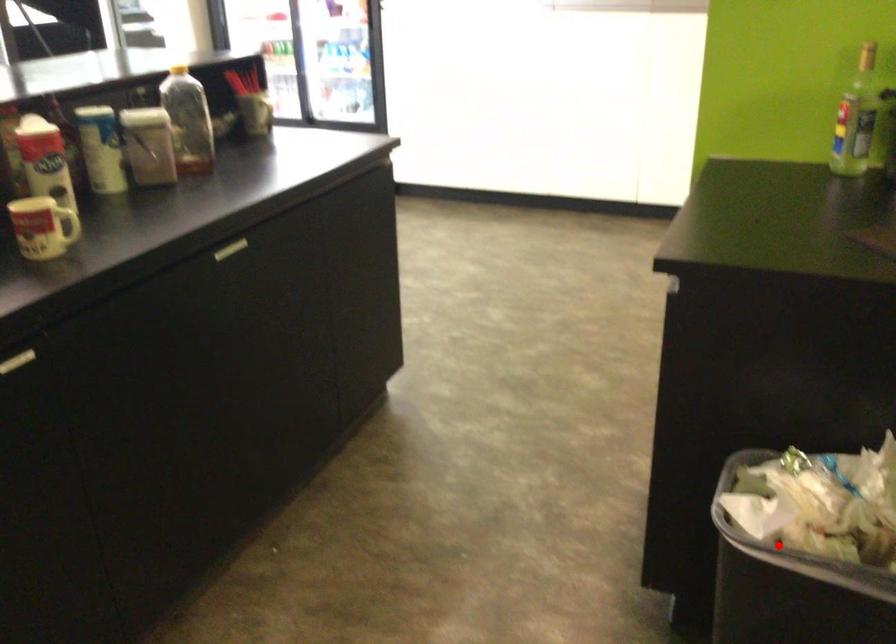
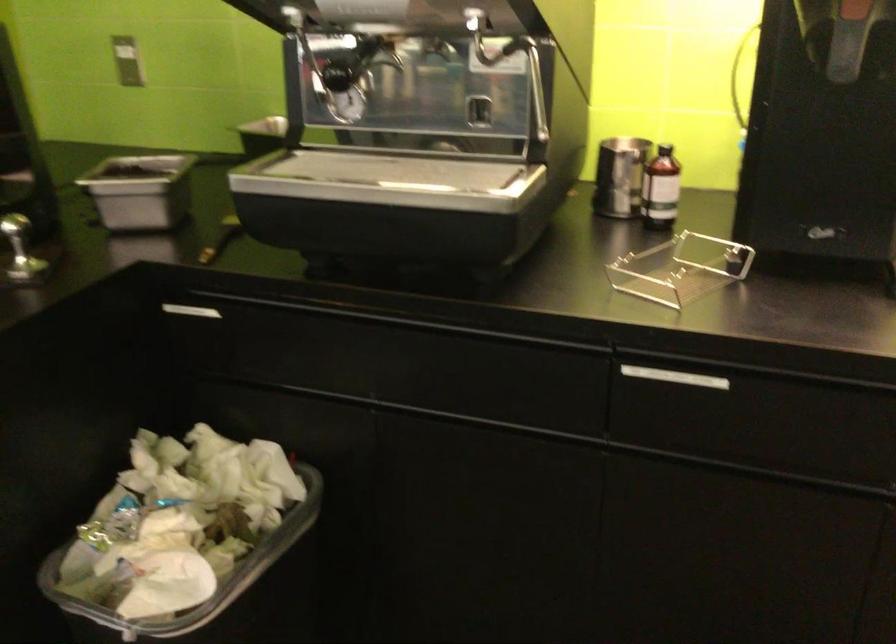
Find the pixel in the second image that matches the highlighted location in the first image.

(218, 592)